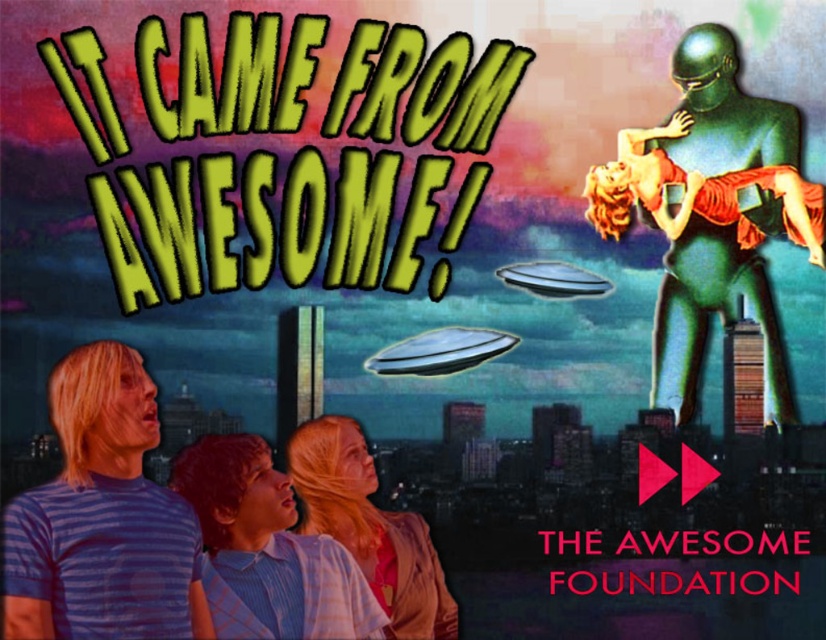
You are an astronaut stranded on an alien planet. You see a green metallic alien at upper right and a light blue striped shirt at lower left. Which object is farther from your current position?

The green metallic alien at upper right is farther from your current position since it is 213.30 feet away from the light blue striped shirt at lower left, implying the alien is further away than the shirt.

You are an astronaut navigating a spacecraft in this surreal scene. You need to locate the green metallic alien at upper right for a mission. According to the coordinates provided, where exactly should you aim your targeting system?

The green metallic alien at upper right is located at point (711, 216), so aim your targeting system at those coordinates to locate it.